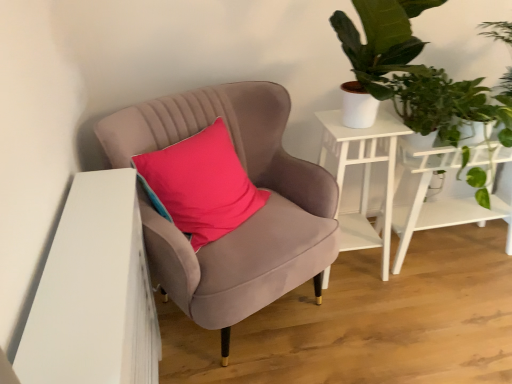
At what (x,y) coordinates should I click in order to perform the action: click on velvet pink pillow at center. Please return your answer as a coordinate pair (x, y). The height and width of the screenshot is (384, 512). Looking at the image, I should click on (201, 185).

The image size is (512, 384). Describe the element at coordinates (438, 201) in the screenshot. I see `white matte table at right, placed as the first table when sorted from right to left` at that location.

Measure the distance between point (370, 0) and camera.

Point (370, 0) is 1.49 meters from camera.

Where is `green leafy plant at upper right`? The image size is (512, 384). green leafy plant at upper right is located at coordinates (447, 105).

Locate an element on the screen. velvet pink pillow at center is located at coordinates (201, 185).

Does green leafy plant at upper right turn towards velvet pink pillow at center?

No, green leafy plant at upper right is not oriented towards velvet pink pillow at center.

Looking at this image, is green leafy plant at upper right next to velvet pink pillow at center and touching it?

No, green leafy plant at upper right is not in contact with velvet pink pillow at center.

How many degrees apart are the facing directions of green leafy plant at upper right and velvet pink pillow at center?

39.4 degrees separate the facing orientations of green leafy plant at upper right and velvet pink pillow at center.

Who is taller, green leafy plant at upper right or velvet pink pillow at center?

velvet pink pillow at center is taller.

Are velvet pink pillow at center and white matte table at right, placed as the first table when sorted from right to left, located far from each other?

No.

From a real-world perspective, between velvet pink pillow at center and white matte table at right, positioned as the second table in left-to-right order, who is vertically higher?

In real-world perspective, velvet pink pillow at center is above.

Considering the sizes of objects velvet pink pillow at center and white matte table at right, placed as the first table when sorted from right to left, in the image provided, who is smaller, velvet pink pillow at center or white matte table at right, placed as the first table when sorted from right to left,?

With smaller size is velvet pink pillow at center.

Is green leafy plant at upper right shorter than white wood side table at upper right, the second table viewed from the right?

Yes, green leafy plant at upper right is shorter than white wood side table at upper right, the second table viewed from the right.

Is the depth of green leafy plant at upper right greater than that of white wood side table at upper right, the second table viewed from the right?

No, the depth of green leafy plant at upper right is less than that of white wood side table at upper right, the second table viewed from the right.

Would you say green leafy plant at upper right is outside white wood side table at upper right, arranged as the 1th table when viewed from the left?

green leafy plant at upper right is positioned outside white wood side table at upper right, arranged as the 1th table when viewed from the left.

From the image's perspective, between green leafy plant at upper right and white wood side table at upper right, arranged as the 1th table when viewed from the left, who is located below?

white wood side table at upper right, arranged as the 1th table when viewed from the left, from the image's perspective.

Where is `houseplant above the white matte table at right, placed as the first table when sorted from right to left (from a real-world perspective)`? The height and width of the screenshot is (384, 512). houseplant above the white matte table at right, placed as the first table when sorted from right to left (from a real-world perspective) is located at coordinates (411, 70).

Is point (394, 10) positioned in front of point (441, 166)?

Yes.

Is green leafy plant at upper right at the right side of white matte table at right, placed as the first table when sorted from right to left?

In fact, green leafy plant at upper right is to the left of white matte table at right, placed as the first table when sorted from right to left.

Measure the distance between green leafy plant at upper right and white matte table at right, placed as the first table when sorted from right to left.

green leafy plant at upper right is 12.23 inches away from white matte table at right, placed as the first table when sorted from right to left.

Can you tell me how much white matte table at right, positioned as the second table in left-to-right order, and white wood side table at upper right, arranged as the 1th table when viewed from the left, differ in facing direction?

The facing directions of white matte table at right, positioned as the second table in left-to-right order, and white wood side table at upper right, arranged as the 1th table when viewed from the left, are 3.9 degrees apart.

Measure the distance from white matte table at right, positioned as the second table in left-to-right order, to white wood side table at upper right, arranged as the 1th table when viewed from the left.

white matte table at right, positioned as the second table in left-to-right order, is 10.59 inches from white wood side table at upper right, arranged as the 1th table when viewed from the left.

Locate an element on the screen. table located on the left of white matte table at right, positioned as the second table in left-to-right order is located at coordinates (362, 177).

From a real-world perspective, who is located lower, white matte table at right, placed as the first table when sorted from right to left, or white wood side table at upper right, arranged as the 1th table when viewed from the left?

white matte table at right, placed as the first table when sorted from right to left.

Can you tell me how much velvet pink chair at center and green leafy plant at upper right differ in facing direction?

27.6 degrees.

Is velvet pink chair at center positioned with its back to green leafy plant at upper right?

No.

Measure the distance from velvet pink chair at center to green leafy plant at upper right.

They are 25.91 inches apart.

From a real-world perspective, is velvet pink chair at center positioned above or below green leafy plant at upper right?

Clearly, from a real-world perspective, velvet pink chair at center is below green leafy plant at upper right.

Which is in front, point (349, 139) or point (152, 196)?

The point (152, 196) is closer.

Locate an element on the screen. Image resolution: width=512 pixels, height=384 pixels. table that is the 1st one below the velvet pink pillow at center (from a real-world perspective) is located at coordinates (362, 177).

Is white wood side table at upper right, arranged as the 1th table when viewed from the left, not inside velvet pink pillow at center?

That's correct, white wood side table at upper right, arranged as the 1th table when viewed from the left, is outside of velvet pink pillow at center.

Considering their positions, is white wood side table at upper right, the second table viewed from the right, located in front of or behind velvet pink pillow at center?

white wood side table at upper right, the second table viewed from the right, is behind velvet pink pillow at center.

This screenshot has width=512, height=384. What are the coordinates of `houseplant lying on the right of velvet pink pillow at center` in the screenshot? It's located at (411, 70).

I want to click on pillow positioned vertically above the white matte table at right, positioned as the second table in left-to-right order (from a real-world perspective), so click(x=201, y=185).

Looking at the image, which one is located further to white matte table at right, positioned as the second table in left-to-right order, green leafy plant at upper right or velvet pink chair at center?

velvet pink chair at center lies further to white matte table at right, positioned as the second table in left-to-right order, than the other object.

When comparing their distances from velvet pink pillow at center, does green leafy plant at upper right or velvet pink chair at center seem closer?

The object closer to velvet pink pillow at center is velvet pink chair at center.

Looking at the image, which one is located further to green leafy plant at upper right, green leafy plant at upper right or velvet pink chair at center?

Among the two, velvet pink chair at center is located further to green leafy plant at upper right.

Based on their spatial positions, is green leafy plant at upper right or white wood side table at upper right, arranged as the 1th table when viewed from the left, further from velvet pink chair at center?

green leafy plant at upper right is further to velvet pink chair at center.

From the image, which object appears to be nearer to white matte table at right, placed as the first table when sorted from right to left, velvet pink chair at center or green leafy plant at upper right?

green leafy plant at upper right is closer to white matte table at right, placed as the first table when sorted from right to left.

From the image, which object appears to be nearer to white matte table at right, placed as the first table when sorted from right to left, velvet pink pillow at center or green leafy plant at upper right?

Based on the image, green leafy plant at upper right appears to be nearer to white matte table at right, placed as the first table when sorted from right to left.

From the picture: Which object lies nearer to the anchor point velvet pink chair at center, green leafy plant at upper right or green leafy plant at upper right?

green leafy plant at upper right is closer to velvet pink chair at center.

From the picture: Considering their positions, is white matte table at right, placed as the first table when sorted from right to left, positioned further to velvet pink chair at center than velvet pink pillow at center?

Among the two, white matte table at right, placed as the first table when sorted from right to left, is located further to velvet pink chair at center.

Where is `vegetation between green leafy plant at upper right and white wood side table at upper right, arranged as the 1th table when viewed from the left, in the up-down direction`? vegetation between green leafy plant at upper right and white wood side table at upper right, arranged as the 1th table when viewed from the left, in the up-down direction is located at coordinates click(447, 105).

Find the location of `vegetation between velvet pink chair at center and white matte table at right, positioned as the second table in left-to-right order, from left to right`. vegetation between velvet pink chair at center and white matte table at right, positioned as the second table in left-to-right order, from left to right is located at coordinates (447, 105).

Image resolution: width=512 pixels, height=384 pixels. I want to click on vegetation between green leafy plant at upper right and white matte table at right, positioned as the second table in left-to-right order, along the z-axis, so click(x=447, y=105).

Find the location of a particular element. houseplant between velvet pink chair at center and green leafy plant at upper right is located at coordinates (411, 70).